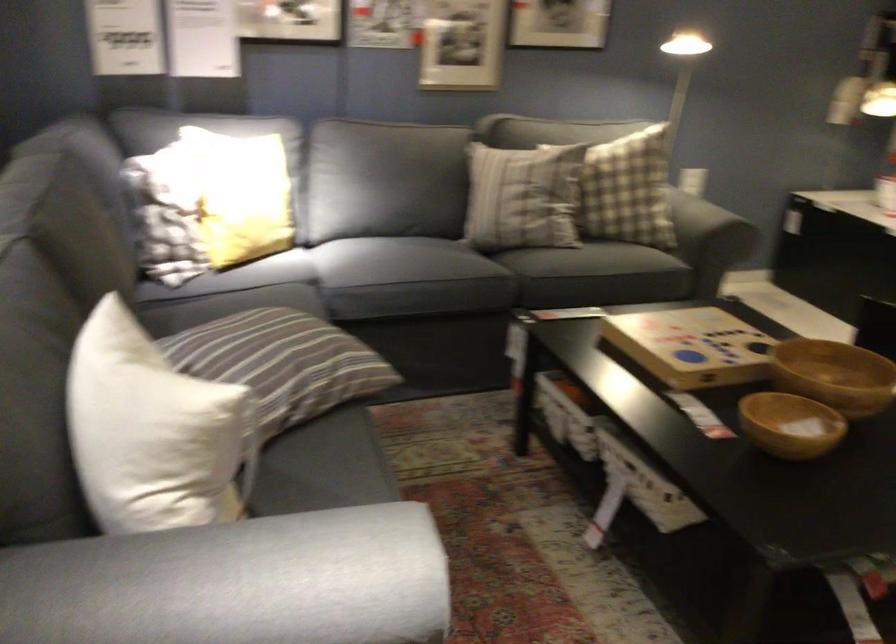
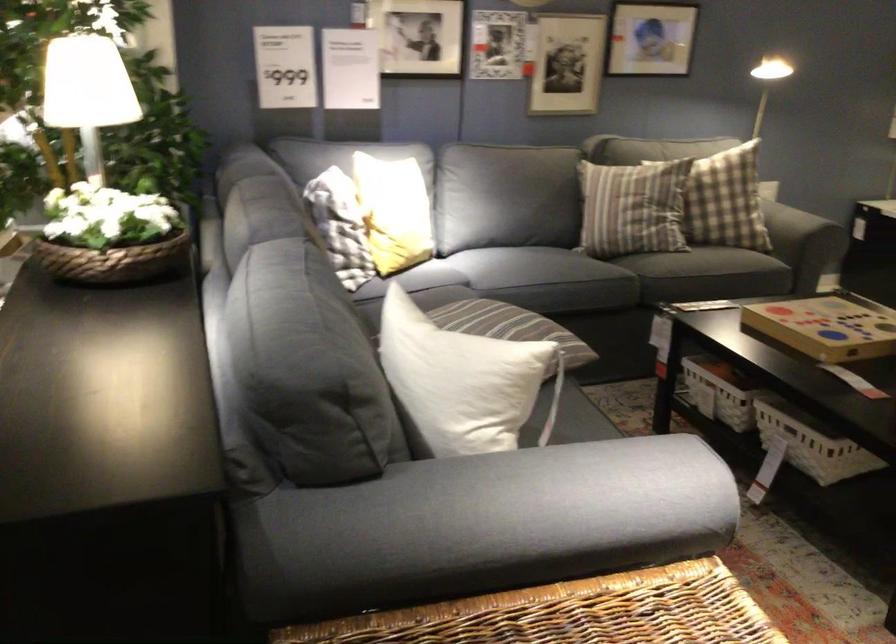
Locate, in the second image, the point that corresponds to (x=501, y=205) in the first image.

(633, 207)